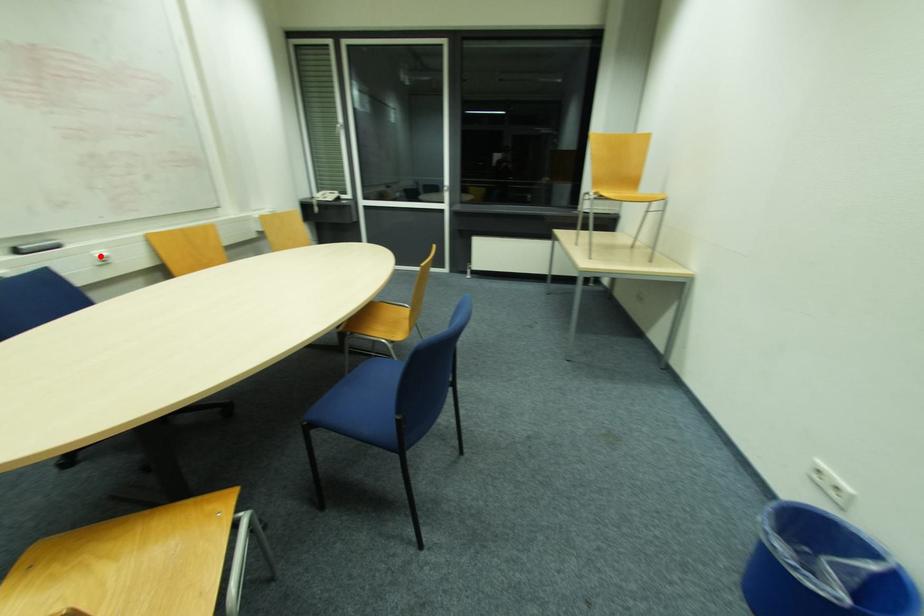
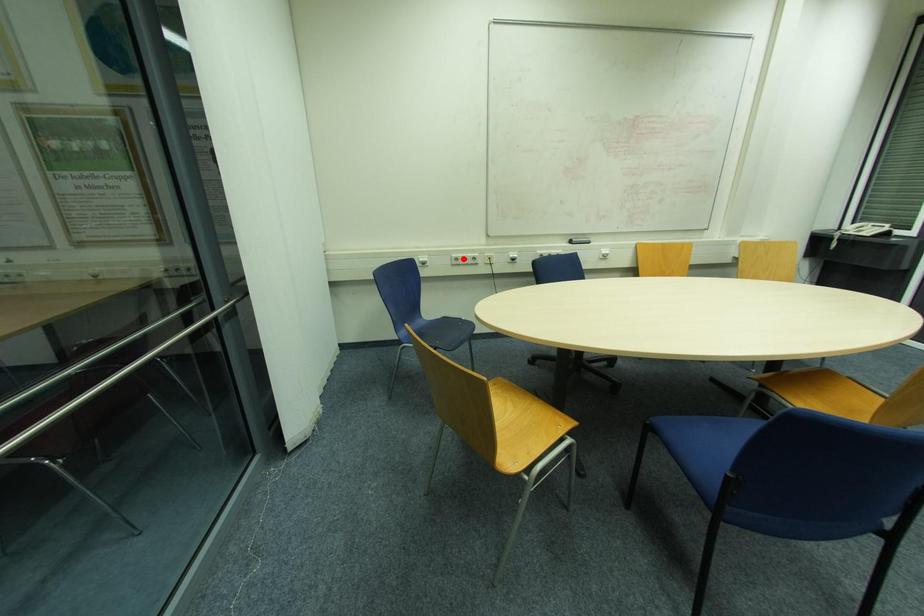
I am providing you with two images of the same scene from different viewpoints. A red point is marked on the first image and another point is marked on the second image. Are the points marked in image1 and image2 representing the same 3D position?

No